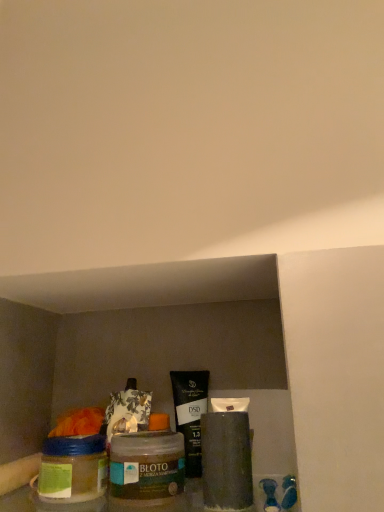
In order to face black matte tube at center, should I rotate leftwards or rightwards?

Turn left approximately 0.306 degrees to face it.

The height and width of the screenshot is (512, 384). Identify the location of matte black tube at center. click(x=227, y=455).

Between matte black tube at center and black matte tube at center, which one has smaller width?

black matte tube at center is thinner.

Between matte black tube at center and black matte tube at center, which one appears on the right side from the viewer's perspective?

From the viewer's perspective, matte black tube at center appears more on the right side.

From a real-world perspective, who is located lower, matte black tube at center or black matte tube at center?

matte black tube at center, from a real-world perspective.

Between matte black tube at center and black matte tube at center, which one has more height?

Standing taller between the two is black matte tube at center.

Would you say black matte tube at center is outside translucent glass jar at lower left?

Absolutely, black matte tube at center is external to translucent glass jar at lower left.

Is black matte tube at center taller or shorter than translucent glass jar at lower left?

black matte tube at center is taller than translucent glass jar at lower left.

Is black matte tube at center oriented away from translucent glass jar at lower left?

No, translucent glass jar at lower left is not at the back of black matte tube at center.

In terms of size, does black matte tube at center appear bigger or smaller than translucent glass jar at lower left?

In the image, black matte tube at center appears to be smaller than translucent glass jar at lower left.

From the picture: From the image's perspective, which is below, matte black tube at center or translucent glass jar at lower left?

translucent glass jar at lower left.

Which of these two, matte black tube at center or translucent glass jar at lower left, stands taller?

matte black tube at center.

Between matte black tube at center and translucent glass jar at lower left, which one has larger size?

translucent glass jar at lower left is bigger.

Considering the sizes of objects matte black tube at center and translucent glass jar at lower left in the image provided, who is wider, matte black tube at center or translucent glass jar at lower left?

With larger width is translucent glass jar at lower left.

Is black matte tube at center inside the boundaries of matte black tube at center, or outside?

black matte tube at center cannot be found inside matte black tube at center.

Between point (172, 388) and point (230, 474), which one is positioned behind?

Point (172, 388)

Is the surface of black matte tube at center in direct contact with matte black tube at center?

Yes, black matte tube at center is with matte black tube at center.

From the image's perspective, is black matte tube at center on matte black tube at center?

Actually, black matte tube at center appears below matte black tube at center in the image.

Is translucent glass jar at lower left facing away from black matte tube at center?

Yes, translucent glass jar at lower left is facing away from black matte tube at center.

Considering the sizes of objects translucent glass jar at lower left and black matte tube at center in the image provided, who is bigger, translucent glass jar at lower left or black matte tube at center?

Bigger between the two is translucent glass jar at lower left.

Is translucent glass jar at lower left located outside black matte tube at center?

Absolutely, translucent glass jar at lower left is external to black matte tube at center.

In the image, is translucent glass jar at lower left positioned in front of or behind matte black tube at center?

In the image, translucent glass jar at lower left appears behind matte black tube at center.

Between translucent glass jar at lower left and matte black tube at center, which one has more height?

With more height is matte black tube at center.

Is translucent glass jar at lower left to the left or to the right of matte black tube at center in the image?

In the image, translucent glass jar at lower left appears on the left side of matte black tube at center.

Is point (149, 488) closer or farther from the camera than point (222, 469)?

Point (149, 488).

Find the location of a particular element. This screenshot has width=384, height=512. product below the matte black tube at center (from the image's perspective) is located at coordinates (190, 414).

The width and height of the screenshot is (384, 512). I want to click on glass jar lying above the black matte tube at center (from the image's perspective), so click(147, 472).

From the picture: Considering their positions, is matte black tube at center positioned closer to translucent glass jar at lower left than black matte tube at center?

Based on the image, matte black tube at center appears to be nearer to translucent glass jar at lower left.

Which object lies further to the anchor point black matte tube at center, matte black tube at center or translucent glass jar at lower left?

translucent glass jar at lower left is positioned further to the anchor black matte tube at center.

Which object lies further to the anchor point matte black tube at center, translucent glass jar at lower left or black matte tube at center?

Based on the image, translucent glass jar at lower left appears to be further to matte black tube at center.

When comparing their distances from black matte tube at center, does translucent glass jar at lower left or matte black tube at center seem closer?

matte black tube at center is closer to black matte tube at center.

Consider the image. Looking at the image, which one is located further to matte black tube at center, black matte tube at center or translucent glass jar at lower left?

translucent glass jar at lower left is positioned further to the anchor matte black tube at center.

From the image, which object appears to be farther from translucent glass jar at lower left, black matte tube at center or matte black tube at center?

black matte tube at center is further to translucent glass jar at lower left.

Locate an element on the screen. glass jar between matte black tube at center and black matte tube at center along the z-axis is located at coordinates (147, 472).